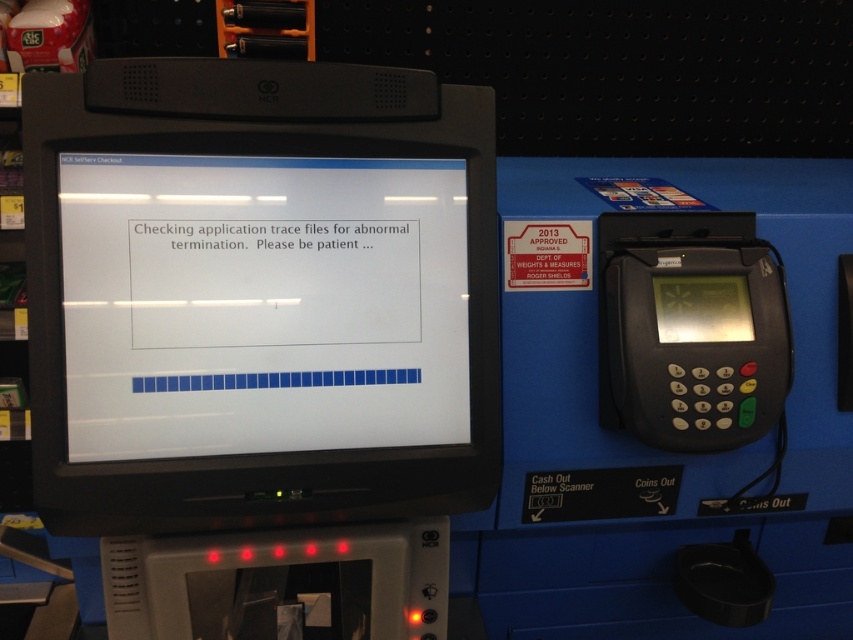
Which is below, black glossy monitor at center or black plastic keypad at right?

black plastic keypad at right

Image resolution: width=853 pixels, height=640 pixels. What do you see at coordinates (258, 294) in the screenshot? I see `black glossy monitor at center` at bounding box center [258, 294].

The width and height of the screenshot is (853, 640). I want to click on black glossy monitor at center, so click(258, 294).